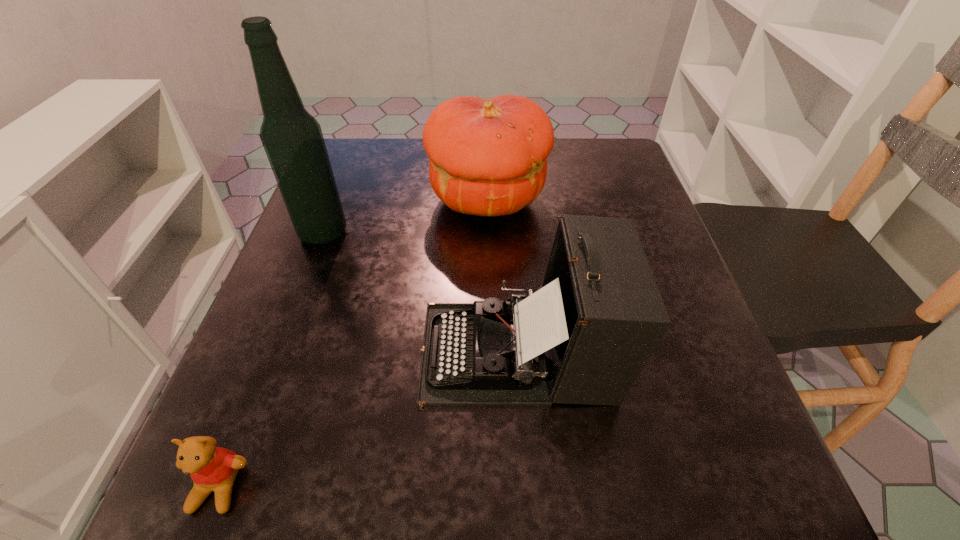
At what (x,y) coordinates should I click in order to perform the action: click on the tallest object. Please return your answer as a coordinate pair (x, y). Image resolution: width=960 pixels, height=540 pixels. Looking at the image, I should click on (292, 138).

The image size is (960, 540). Find the location of `pumpkin`. pumpkin is located at coordinates (488, 157).

Where is `the third farthest object`? the third farthest object is located at coordinates (583, 338).

At what (x,y) coordinates should I click in order to perform the action: click on teddy bear. Please return your answer as a coordinate pair (x, y). Image resolution: width=960 pixels, height=540 pixels. Looking at the image, I should click on (211, 468).

Identify the location of the nearest object. (211, 468).

At what (x,y) coordinates should I click in order to perform the action: click on vacant area situated on the front of the tallest object. Please return your answer as a coordinate pair (x, y). This screenshot has width=960, height=540. Looking at the image, I should click on (283, 340).

The height and width of the screenshot is (540, 960). In order to click on vacant area situated 0.050m on the left of the pumpkin in this screenshot , I will do coord(406,199).

This screenshot has height=540, width=960. Find the location of `free point located inside the open case of the typewriter`. free point located inside the open case of the typewriter is located at coordinates (347, 352).

The image size is (960, 540). Identify the location of free spot located 0.230m inside the open case of the typewriter. (277, 352).

The image size is (960, 540). Find the location of `free space located 0.100m inside the open case of the typewriter`. free space located 0.100m inside the open case of the typewriter is located at coordinates (359, 352).